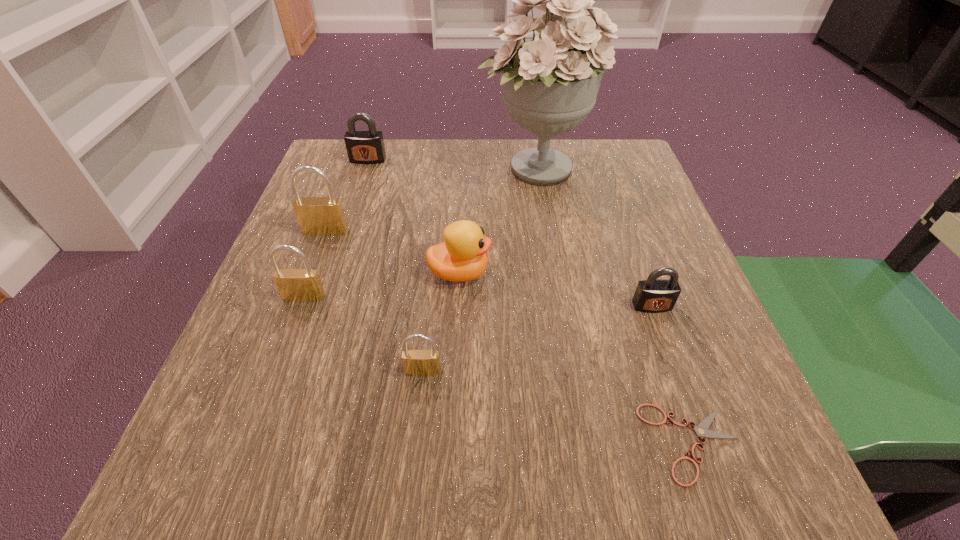
The height and width of the screenshot is (540, 960). I want to click on object that is at the far right corner, so click(550, 83).

The width and height of the screenshot is (960, 540). I want to click on object that is positioned at the near right corner, so click(701, 430).

Image resolution: width=960 pixels, height=540 pixels. Find the location of `free location at the far edge`. free location at the far edge is located at coordinates (464, 145).

In order to click on vacant space at the near edge of the desktop in this screenshot , I will do `click(552, 479)`.

In the image, there is a desktop. Identify the location of blank space at the right edge. (661, 226).

In the image, there is a desktop. Identify the location of vacant area at the far left corner. Image resolution: width=960 pixels, height=540 pixels. click(373, 188).

Find the location of a particular element. vacant space at the near left corner of the desktop is located at coordinates coord(223,470).

In the image, there is a desktop. At what (x,y) coordinates should I click in order to perform the action: click on vacant space at the far right corner. Please return your answer as a coordinate pair (x, y). Looking at the image, I should click on (617, 157).

Identify the location of vacant space at the near right corner of the desktop. (671, 495).

Where is `empty space that is in between the green bouquet and the seventh shortest object`? The height and width of the screenshot is (540, 960). empty space that is in between the green bouquet and the seventh shortest object is located at coordinates pos(430,200).